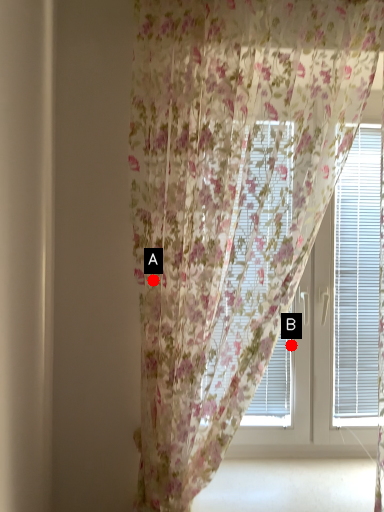
Question: Two points are circled on the image, labeled by A and B beside each circle. Which point is farther to the camera?

Choices:
 (A) A is further
 (B) B is further

Answer: (B)